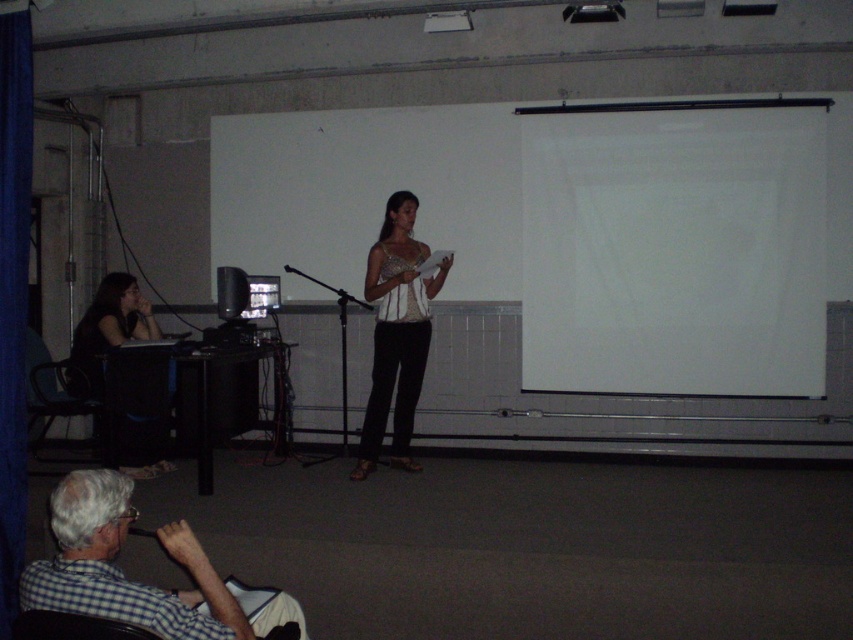
Is point (68, 627) positioned behind point (584, 19)?

No.

Who is more distant from viewer, (83, 614) or (619, 10)?

The point (619, 10) is more distant.

Is point (68, 628) closer to viewer compared to point (573, 20)?

Yes, point (68, 628) is closer to viewer.

The image size is (853, 640). Find the location of `checkered fabric chair at lower left`. checkered fabric chair at lower left is located at coordinates (73, 627).

Between dark hair at left and black plastic chair at left, which one has less height?

dark hair at left

In the scene shown: Between dark hair at left and black plastic chair at left, which one is positioned higher?

dark hair at left is above.

Is point (94, 364) less distant than point (67, 403)?

Yes.

The width and height of the screenshot is (853, 640). Find the location of `dark hair at left`. dark hair at left is located at coordinates (107, 332).

Between point (575, 276) and point (44, 396), which one is positioned in front?

Point (44, 396) is in front.

Is point (619, 291) farther from viewer compared to point (45, 376)?

Yes, it is behind point (45, 376).

Identify the location of white matte projection screen at upper right. [x=674, y=246].